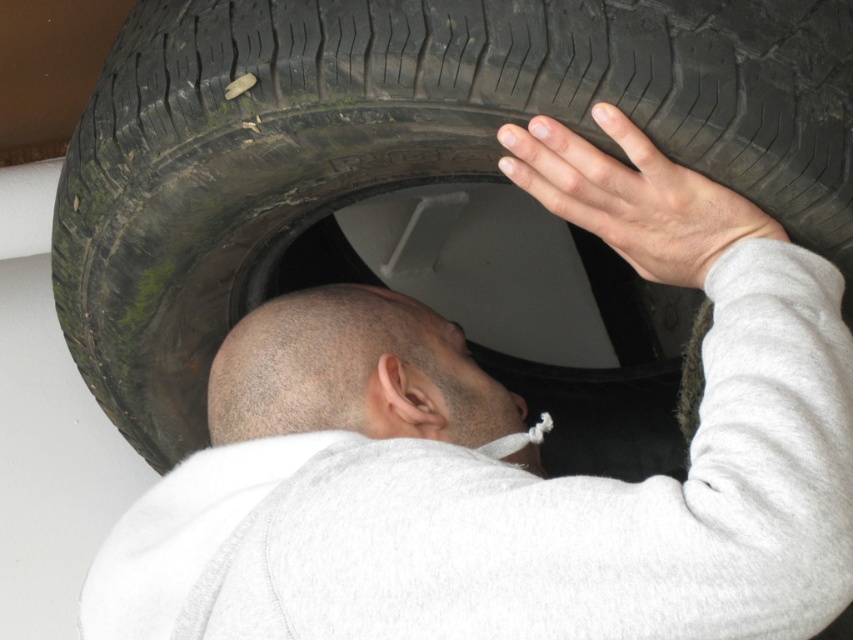
Question: Among these objects, which one is farthest from the camera?

Choices:
 (A) black rubber tire at upper center
 (B) bald head at center
 (C) smooth skin hand at upper right

Answer: (B)

Question: Is black rubber tire at upper center bigger than bald head at center?

Choices:
 (A) yes
 (B) no

Answer: (A)

Question: Can you confirm if black rubber tire at upper center is positioned below smooth skin hand at upper right?

Choices:
 (A) yes
 (B) no

Answer: (A)

Question: Estimate the real-world distances between objects in this image. Which object is closer to the smooth skin hand at upper right?

Choices:
 (A) black rubber tire at upper center
 (B) bald head at center

Answer: (A)

Question: Does black rubber tire at upper center have a smaller size compared to smooth skin hand at upper right?

Choices:
 (A) yes
 (B) no

Answer: (B)

Question: Which point appears farthest from the camera in this image?

Choices:
 (A) (654, 204)
 (B) (846, 65)

Answer: (A)